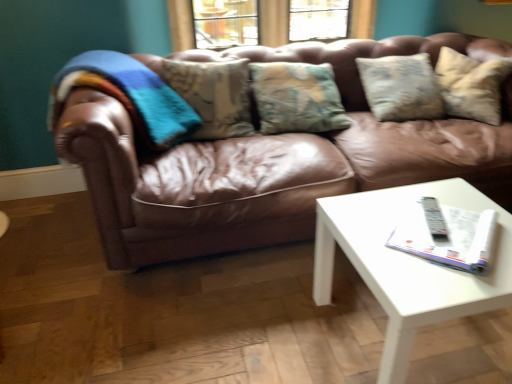
Locate an element on the screen. This screenshot has height=384, width=512. free space in front of white glossy magazine at center right is located at coordinates (449, 281).